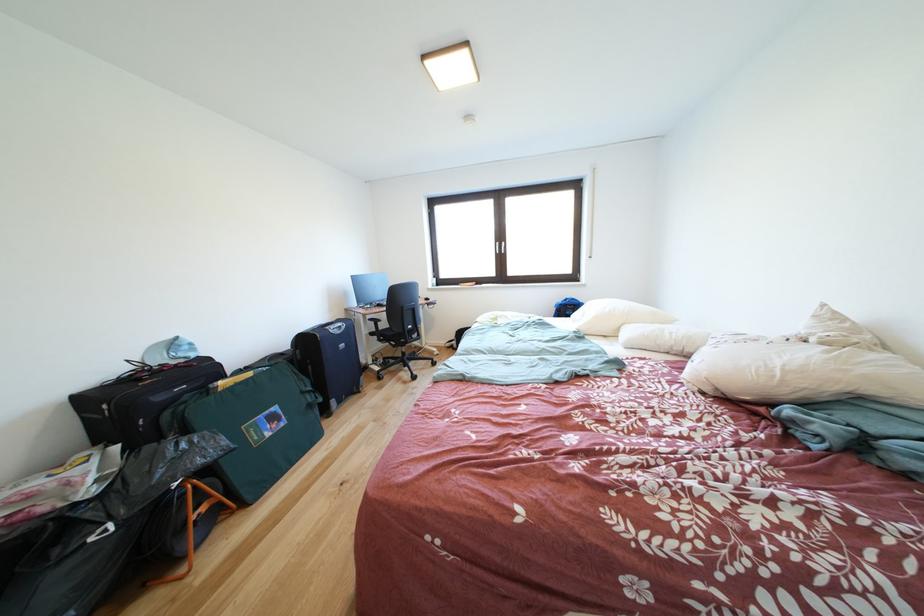
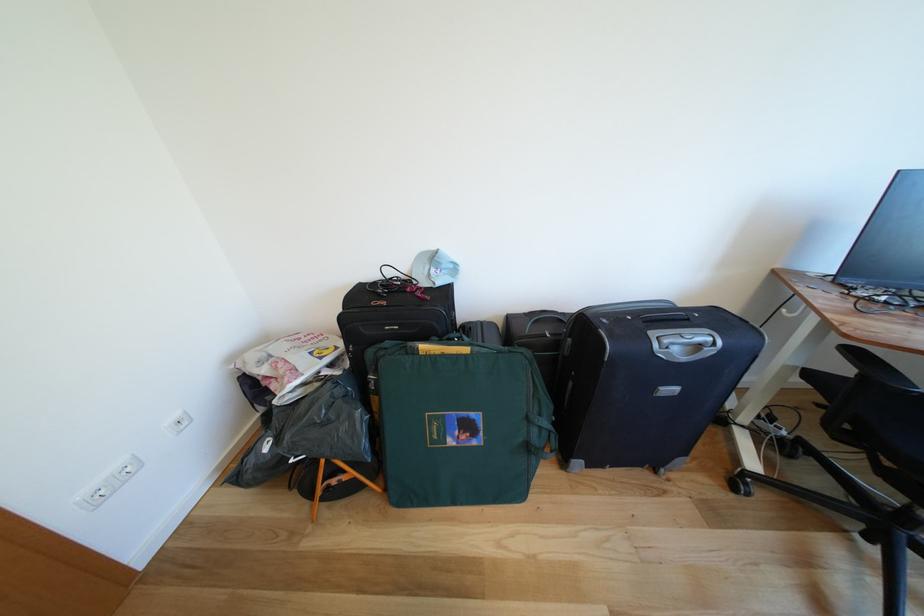
Where in the second image is the point corresponding to point 348,331 from the first image?

(707, 351)